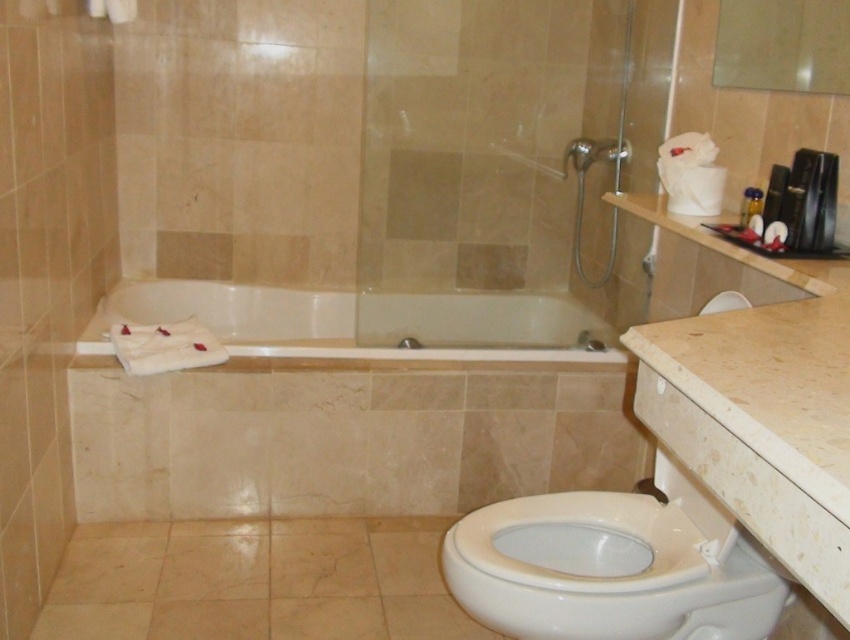
The height and width of the screenshot is (640, 850). In order to click on white glossy bathtub at center in this screenshot , I will do `click(350, 323)`.

How far apart are white glossy bathtub at center and matte silver showerhead at upper center?

white glossy bathtub at center and matte silver showerhead at upper center are 23.97 inches apart.

Is point (279, 356) behind point (590, 147)?

No, it is in front of (590, 147).

Image resolution: width=850 pixels, height=640 pixels. I want to click on white glossy bathtub at center, so 350,323.

Which is above, white glossy toilet bowl at lower right or matte silver showerhead at upper center?

Positioned higher is matte silver showerhead at upper center.

Which is in front, point (602, 529) or point (615, 256)?

Point (602, 529)

You are a GUI agent. You are given a task and a screenshot of the screen. Output one action in this format:
    pyautogui.click(x=<x>, y=<y>)
    Task: Click on the white glossy toilet bowl at lower right
    This screenshot has width=850, height=640.
    Given the screenshot: What is the action you would take?
    pyautogui.click(x=605, y=572)

Who is higher up, white glossy toilet bowl at lower right or white glossy bathtub at center?

white glossy bathtub at center is higher up.

Does white glossy toilet bowl at lower right appear on the left side of white glossy bathtub at center?

No, white glossy toilet bowl at lower right is not to the left of white glossy bathtub at center.

Identify the location of white glossy toilet bowl at lower right. The image size is (850, 640). (605, 572).

Locate an element on the screen. white glossy toilet bowl at lower right is located at coordinates (605, 572).